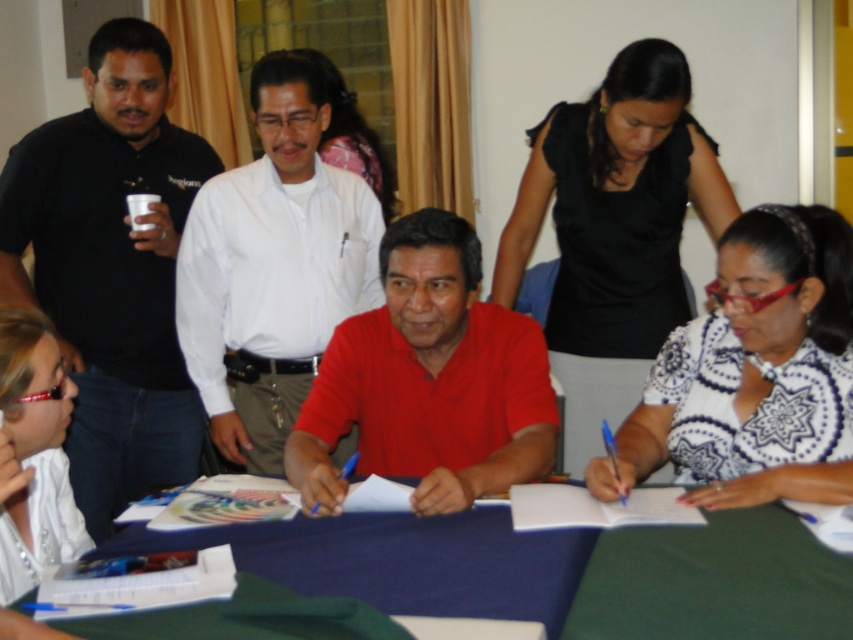
Question: Among these objects, which one is farthest from the camera?

Choices:
 (A) white glossy shirt at lower left
 (B) matte red polo shirt at center
 (C) white smooth shirt at center

Answer: (C)

Question: Which point is closer to the camera?

Choices:
 (A) (386, 424)
 (B) (677, 378)
 (C) (132, 369)
 (D) (241, 212)

Answer: (B)

Question: Is the position of white smooth shirt at center more distant than that of black matte dress at upper right?

Choices:
 (A) no
 (B) yes

Answer: (B)

Question: Is white smooth shirt at center to the right of matte red polo shirt at center from the viewer's perspective?

Choices:
 (A) no
 (B) yes

Answer: (A)

Question: Can you confirm if black shirt at left is wider than white smooth shirt at center?

Choices:
 (A) no
 (B) yes

Answer: (A)

Question: Which object appears farthest from the camera in this image?

Choices:
 (A) green fabric table at center
 (B) black matte dress at upper right
 (C) black shirt at left

Answer: (C)